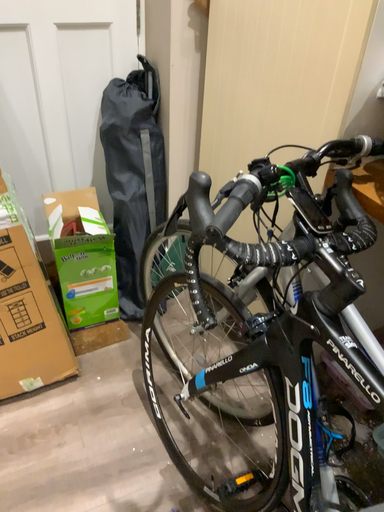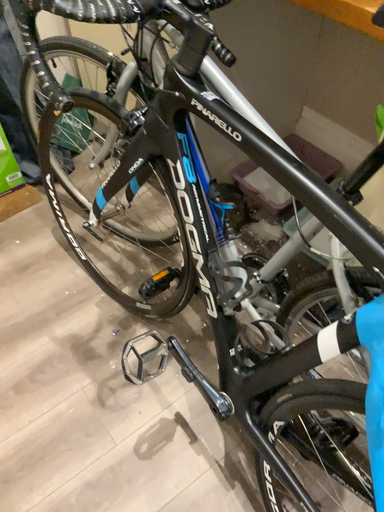
Question: Which way did the camera rotate in the video?

Choices:
 (A) rotated downward
 (B) rotated upward

Answer: (A)